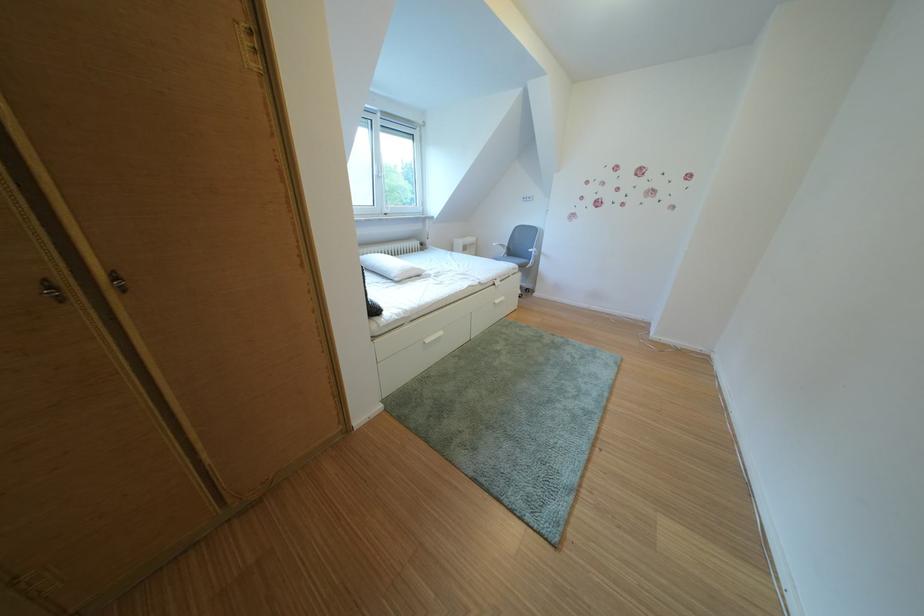
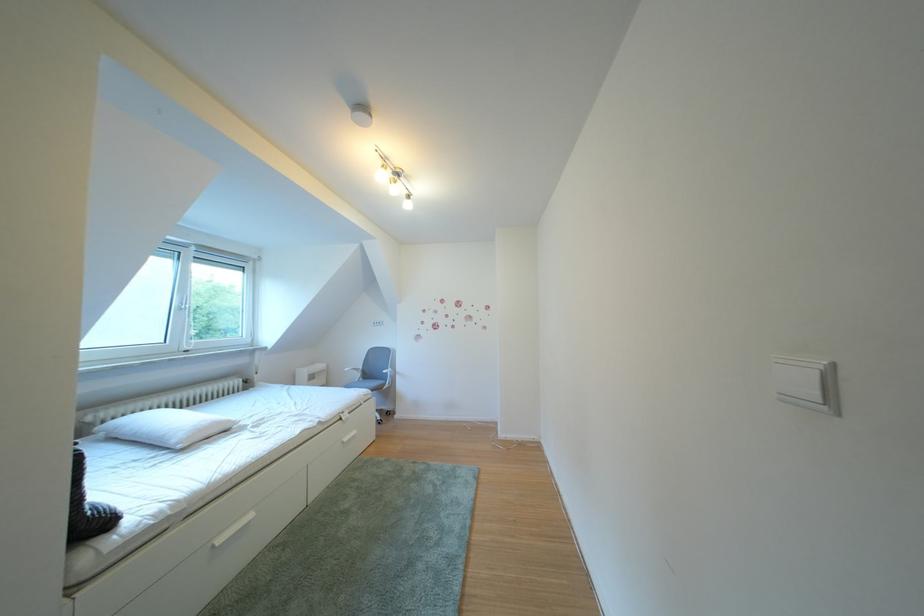
First-person continuous shooting, in which direction is the camera rotating?

The camera's rotation is toward right-up.